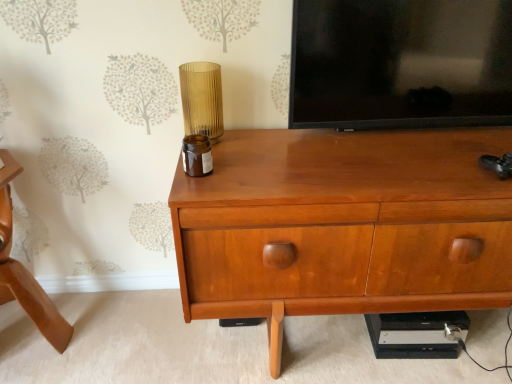
The height and width of the screenshot is (384, 512). I want to click on unoccupied region to the right of translucent amber glass at center, so click(x=250, y=138).